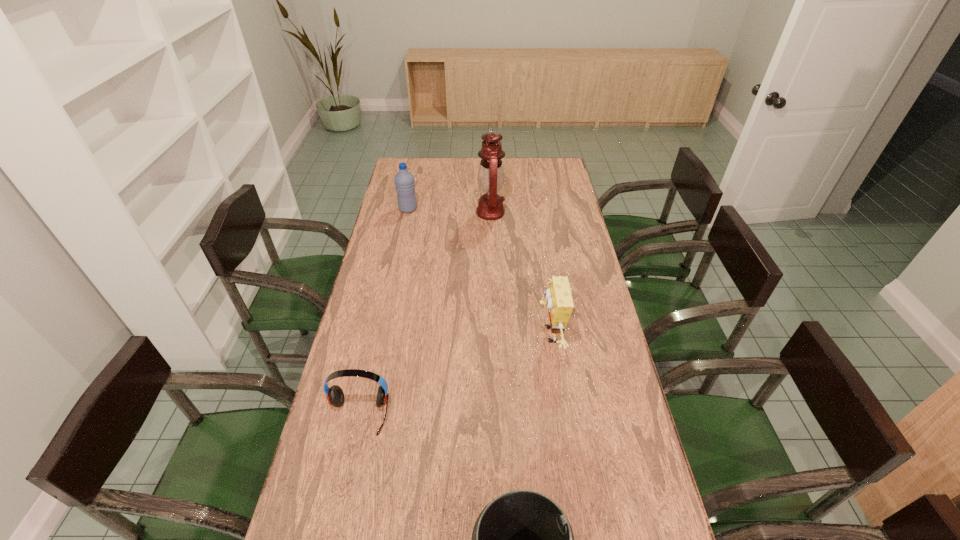
You are a GUI agent. You are given a task and a screenshot of the screen. Output one action in this format:
    pyautogui.click(x=<x>, y=<y>)
    Task: Click on the free space between the water bottle and the oil lamp
    The image size is (960, 540).
    Given the screenshot: What is the action you would take?
    pyautogui.click(x=449, y=211)

I want to click on vacant space that's between the water bottle and the oil lamp, so click(449, 211).

In order to click on empty space between the third nearest object and the tallest object in this screenshot , I will do `click(519, 274)`.

Find the location of a particular element. vacant space that's between the sponge and the shortest object is located at coordinates (454, 375).

Where is `free space that is in between the tallest object and the water bottle`? free space that is in between the tallest object and the water bottle is located at coordinates (449, 211).

You are a GUI agent. You are given a task and a screenshot of the screen. Output one action in this format:
    pyautogui.click(x=<x>, y=<y>)
    Task: Click on the object that is the closest to the fourth farthest object
    The width and height of the screenshot is (960, 540).
    Given the screenshot: What is the action you would take?
    pyautogui.click(x=522, y=539)

This screenshot has height=540, width=960. I want to click on object that stands as the fourth closest to the water bottle, so click(x=522, y=539).